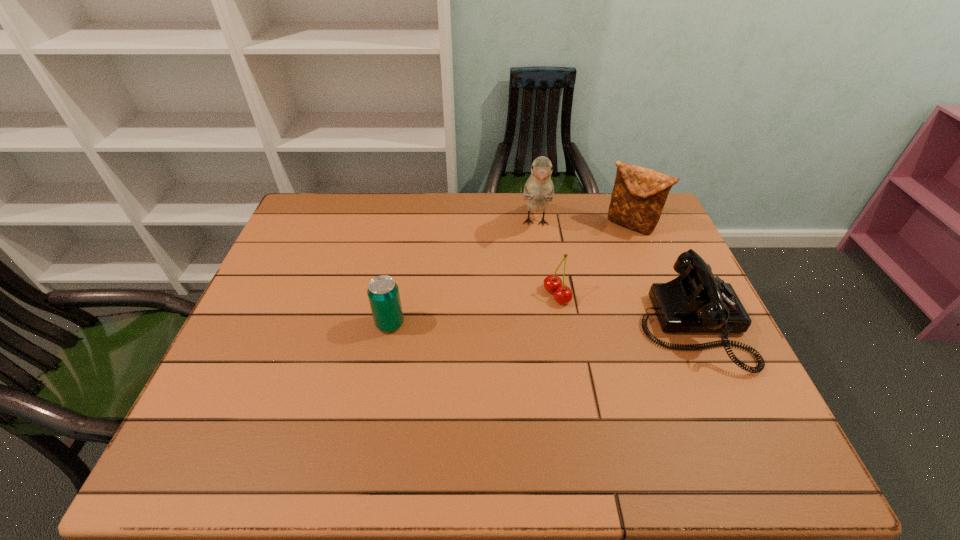
Where is `vacant spot on the desktop that is between the beer can and the telephone and is positioned on the open side of the clutch bag`? This screenshot has width=960, height=540. vacant spot on the desktop that is between the beer can and the telephone and is positioned on the open side of the clutch bag is located at coordinates (534, 325).

The width and height of the screenshot is (960, 540). In order to click on free space on the desktop that is between the beer can and the telephone and is positioned at the face of the tallest object in this screenshot , I will do [531, 325].

Locate an element on the screen. The width and height of the screenshot is (960, 540). free spot on the desktop that is between the leftmost object and the telephone and is positioned with the stems of the cherry pointing upwards is located at coordinates (495, 324).